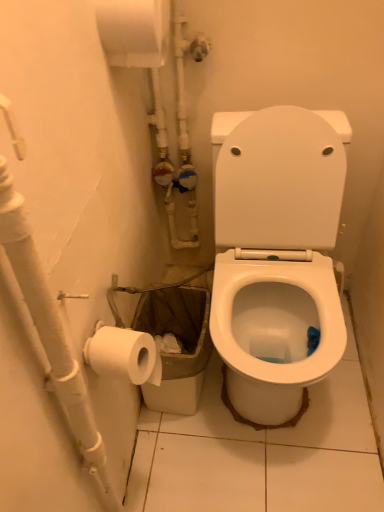
You are a GUI agent. You are given a task and a screenshot of the screen. Output one action in this format:
    pyautogui.click(x=<x>, y=<y>)
    Task: Click on the white matte water pipe at left
    This screenshot has width=384, height=512.
    Given the screenshot: What is the action you would take?
    pyautogui.click(x=52, y=333)

Measure the distance between white matte water pipe at left and camera.

The depth of white matte water pipe at left is 15.61 inches.

The width and height of the screenshot is (384, 512). What do you see at coordinates (52, 333) in the screenshot?
I see `white matte water pipe at left` at bounding box center [52, 333].

The height and width of the screenshot is (512, 384). What are the coordinates of `white matte toilet paper at upper left` in the screenshot? It's located at (134, 31).

What do you see at coordinates (134, 31) in the screenshot? I see `white matte toilet paper at upper left` at bounding box center [134, 31].

Find the location of a particular element. This screenshot has height=512, width=384. white matte water pipe at left is located at coordinates (52, 333).

Considering the relative positions of white matte toilet paper at upper left and white matte water pipe at left in the image provided, is white matte toilet paper at upper left to the right of white matte water pipe at left from the viewer's perspective?

Correct, you'll find white matte toilet paper at upper left to the right of white matte water pipe at left.

Is white matte toilet paper at upper left closer to the viewer compared to white matte water pipe at left?

No, the depth of white matte toilet paper at upper left is greater than that of white matte water pipe at left.

Which point is more distant from viewer, (118, 35) or (14, 239)?

The point (118, 35) is more distant.

From the image's perspective, is white matte toilet paper at upper left below white matte water pipe at left?

Incorrect, from the image's perspective, white matte toilet paper at upper left is higher than white matte water pipe at left.

From a real-world perspective, is white matte toilet paper at upper left above or below white matte water pipe at left?

From a real-world perspective, white matte toilet paper at upper left is physically above white matte water pipe at left.

Between white matte toilet paper at upper left and white matte water pipe at left, which one has smaller width?

Thinner between the two is white matte water pipe at left.

From their relative heights in the image, would you say white matte toilet paper at upper left is taller or shorter than white matte water pipe at left?

white matte toilet paper at upper left is shorter than white matte water pipe at left.

Looking at the image, does white matte toilet paper at upper left seem bigger or smaller compared to white matte water pipe at left?

white matte toilet paper at upper left is smaller than white matte water pipe at left.

Is white matte toilet paper at upper left outside of white matte water pipe at left?

Absolutely, white matte toilet paper at upper left is external to white matte water pipe at left.

Consider the image. Is white matte toilet paper at upper left not near white matte water pipe at left?

No, white matte toilet paper at upper left is in close proximity to white matte water pipe at left.

Could you tell me if white matte toilet paper at upper left is facing white matte water pipe at left?

No, white matte toilet paper at upper left is not turned towards white matte water pipe at left.

Consider the image. How different are the orientations of white matte toilet paper at upper left and white matte water pipe at left in degrees?

white matte toilet paper at upper left and white matte water pipe at left are facing 3.16 degrees away from each other.

Where is `water pipe below the white matte toilet paper at upper left (from a real-world perspective)`? water pipe below the white matte toilet paper at upper left (from a real-world perspective) is located at coordinates (52, 333).

Considering the positions of objects white matte water pipe at left and white matte toilet paper at upper left in the image provided, who is more to the right, white matte water pipe at left or white matte toilet paper at upper left?

From the viewer's perspective, white matte toilet paper at upper left appears more on the right side.

Does white matte water pipe at left come behind white matte toilet paper at upper left?

That is False.

Between point (29, 236) and point (127, 36), which one is positioned in front?

Positioned in front is point (29, 236).

From the image's perspective, is white matte water pipe at left located above or below white matte toilet paper at upper left?

Based on their image positions, white matte water pipe at left is located beneath white matte toilet paper at upper left.

From a real-world perspective, is white matte water pipe at left physically above white matte toilet paper at upper left?

No, from a real-world perspective, white matte water pipe at left is not over white matte toilet paper at upper left

Is white matte water pipe at left wider than white matte toilet paper at upper left?

No.

Considering the relative sizes of white matte water pipe at left and white matte toilet paper at upper left in the image provided, is white matte water pipe at left shorter than white matte toilet paper at upper left?

Incorrect, the height of white matte water pipe at left does not fall short of that of white matte toilet paper at upper left.

Considering the sizes of objects white matte water pipe at left and white matte toilet paper at upper left in the image provided, who is bigger, white matte water pipe at left or white matte toilet paper at upper left?

With larger size is white matte water pipe at left.

Would you say white matte toilet paper at upper left is part of white matte water pipe at left's contents?

No, white matte toilet paper at upper left is not a part of white matte water pipe at left.

Is white matte water pipe at left next to white matte toilet paper at upper left and touching it?

There is a gap between white matte water pipe at left and white matte toilet paper at upper left.

Is white matte water pipe at left turned away from white matte toilet paper at upper left?

white matte water pipe at left is not turned away from white matte toilet paper at upper left.

From the picture: Can you tell me how much white matte water pipe at left and white matte toilet paper at upper left differ in facing direction?

The facing directions of white matte water pipe at left and white matte toilet paper at upper left are 3.16 degrees apart.

How far apart are white matte water pipe at left and white matte toilet paper at upper left?

The distance of white matte water pipe at left from white matte toilet paper at upper left is 62.73 centimeters.

The height and width of the screenshot is (512, 384). I want to click on toilet paper above the white matte water pipe at left (from a real-world perspective), so click(134, 31).

The height and width of the screenshot is (512, 384). Identify the location of water pipe lying below the white matte toilet paper at upper left (from the image's perspective). 52,333.

What are the coordinates of `toilet paper above the white matte water pipe at left (from a real-world perspective)` in the screenshot? It's located at (134, 31).